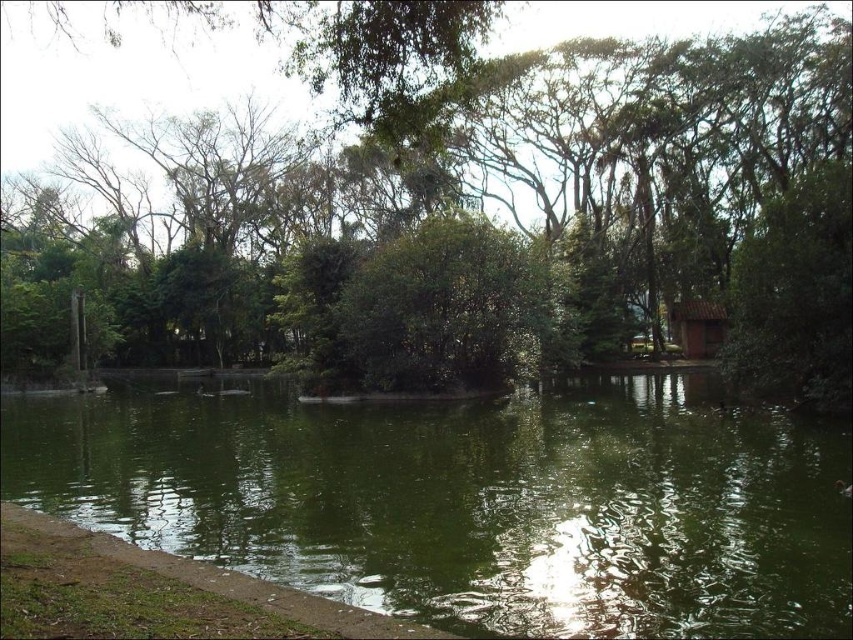
Which of these two, green leafy tree at center or green liquid water at center, stands taller?

green leafy tree at center is taller.

Can you confirm if green leafy tree at center is positioned to the left of green liquid water at center?

Correct, you'll find green leafy tree at center to the left of green liquid water at center.

The width and height of the screenshot is (853, 640). What do you see at coordinates (531, 196) in the screenshot? I see `green leafy tree at center` at bounding box center [531, 196].

Locate an element on the screen. This screenshot has width=853, height=640. green leafy tree at center is located at coordinates (531, 196).